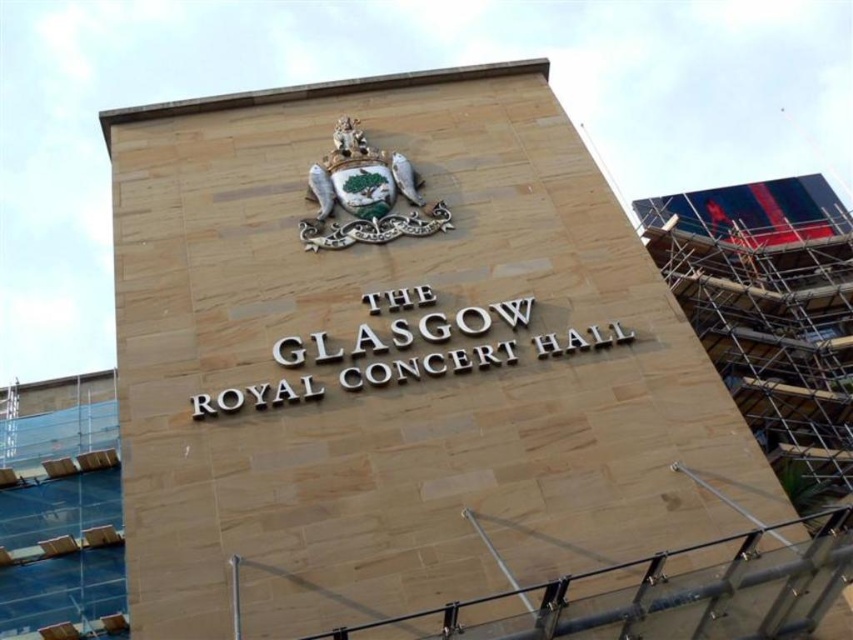
Question: Does scaffolding at right come behind enamel crest at upper center?

Choices:
 (A) yes
 (B) no

Answer: (A)

Question: Can you confirm if scaffolding at right is positioned above enamel crest at upper center?

Choices:
 (A) yes
 (B) no

Answer: (B)

Question: Which of the following is the closest to the observer?

Choices:
 (A) (305, 246)
 (B) (784, 177)

Answer: (A)

Question: Does scaffolding at right appear on the left side of enamel crest at upper center?

Choices:
 (A) yes
 (B) no

Answer: (B)

Question: Which point is closer to the camera?

Choices:
 (A) (312, 188)
 (B) (787, 259)

Answer: (A)

Question: Which object is farther from the camera taking this photo?

Choices:
 (A) scaffolding at right
 (B) enamel crest at upper center

Answer: (A)